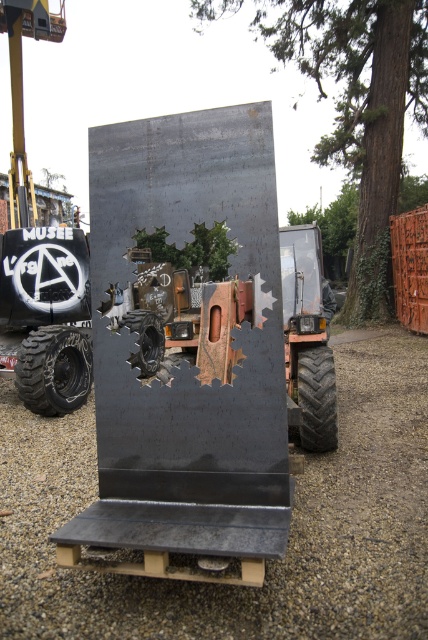
Question: Which point is farther to the camera?

Choices:
 (A) (315, 371)
 (B) (160, 362)
 (C) (91, 378)

Answer: (B)

Question: Considering the real-world distances, which object is farthest from the black rubber tractor at left?

Choices:
 (A) black rubber tire at center
 (B) black rubber tire at lower right
 (C) black rubber tire at lower left
 (D) rubber/soft tire at center

Answer: (D)

Question: Can you confirm if black rubber tractor at left is positioned to the right of black rubber tire at lower right?

Choices:
 (A) yes
 (B) no

Answer: (B)

Question: Does black rubber tire at lower left have a smaller size compared to black rubber tire at center?

Choices:
 (A) no
 (B) yes

Answer: (B)

Question: Which object is positioned farthest from the black rubber tire at lower right?

Choices:
 (A) black rubber tractor at left
 (B) black rubber tire at center
 (C) black rubber tire at lower left
 (D) rubber/soft tire at center

Answer: (A)

Question: Is black rubber tire at lower left to the left of black rubber tire at center from the viewer's perspective?

Choices:
 (A) no
 (B) yes

Answer: (B)